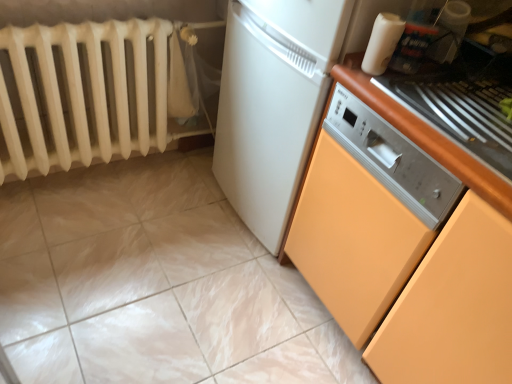
Question: From the image's perspective, is orange matte cabinet at right located beneath orange matte countertop at right?

Choices:
 (A) no
 (B) yes

Answer: (B)

Question: Would you say orange matte cabinet at right is outside orange matte countertop at right?

Choices:
 (A) yes
 (B) no

Answer: (A)

Question: Is orange matte cabinet at right to the left of orange matte countertop at right from the viewer's perspective?

Choices:
 (A) no
 (B) yes

Answer: (B)

Question: From the image's perspective, is orange matte cabinet at right located above orange matte countertop at right?

Choices:
 (A) no
 (B) yes

Answer: (A)

Question: Are orange matte cabinet at right and orange matte countertop at right far apart?

Choices:
 (A) yes
 (B) no

Answer: (B)

Question: Is orange matte cabinet at right turned away from orange matte countertop at right?

Choices:
 (A) no
 (B) yes

Answer: (A)

Question: Does white glossy tile at lower center come in front of orange matte cabinet at right?

Choices:
 (A) no
 (B) yes

Answer: (A)

Question: Is white glossy tile at lower center further to the viewer compared to orange matte cabinet at right?

Choices:
 (A) no
 (B) yes

Answer: (B)

Question: Considering the relative sizes of white glossy tile at lower center and orange matte cabinet at right in the image provided, is white glossy tile at lower center smaller than orange matte cabinet at right?

Choices:
 (A) no
 (B) yes

Answer: (B)

Question: Does white glossy tile at lower center turn towards orange matte cabinet at right?

Choices:
 (A) yes
 (B) no

Answer: (B)

Question: Does white glossy tile at lower center appear on the right side of orange matte cabinet at right?

Choices:
 (A) yes
 (B) no

Answer: (B)

Question: Is white glossy tile at lower center taller than orange matte cabinet at right?

Choices:
 (A) yes
 (B) no

Answer: (B)

Question: Considering the relative sizes of white matte radiator at left and white glossy plastic container at upper right in the image provided, is white matte radiator at left smaller than white glossy plastic container at upper right?

Choices:
 (A) yes
 (B) no

Answer: (B)